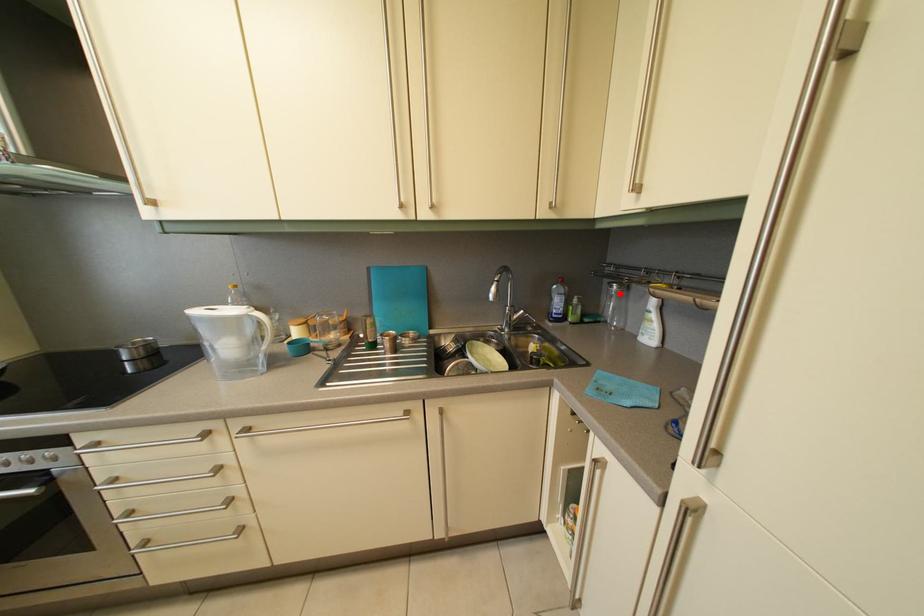
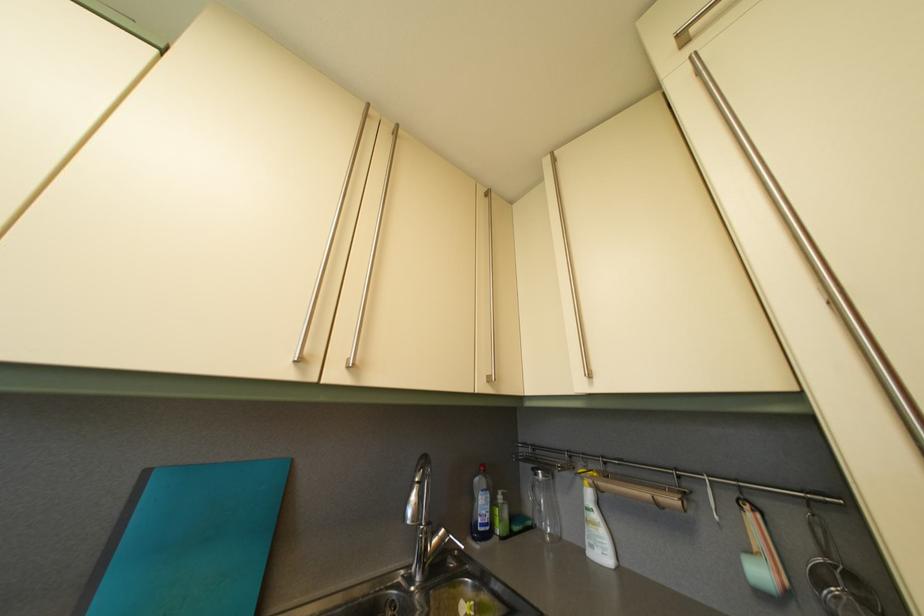
The point at the highlighted location is marked in the first image. Where is the corresponding point in the second image?

(544, 482)